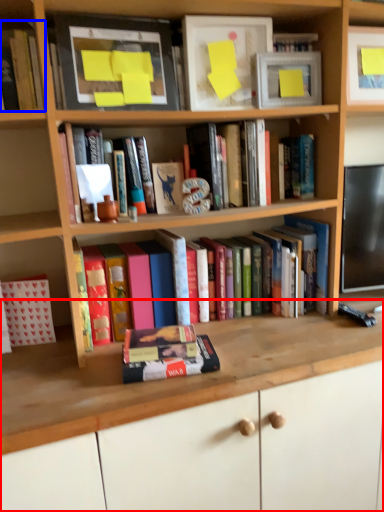
Question: Which object appears closest to the camera in this image, computer desk (highlighted by a red box) or book (highlighted by a blue box)?

Choices:
 (A) computer desk
 (B) book

Answer: (A)